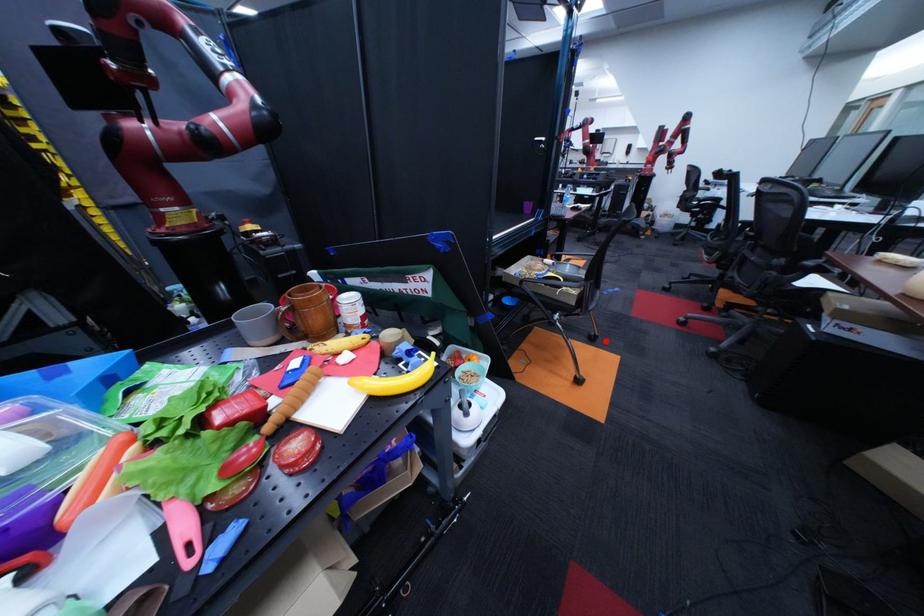
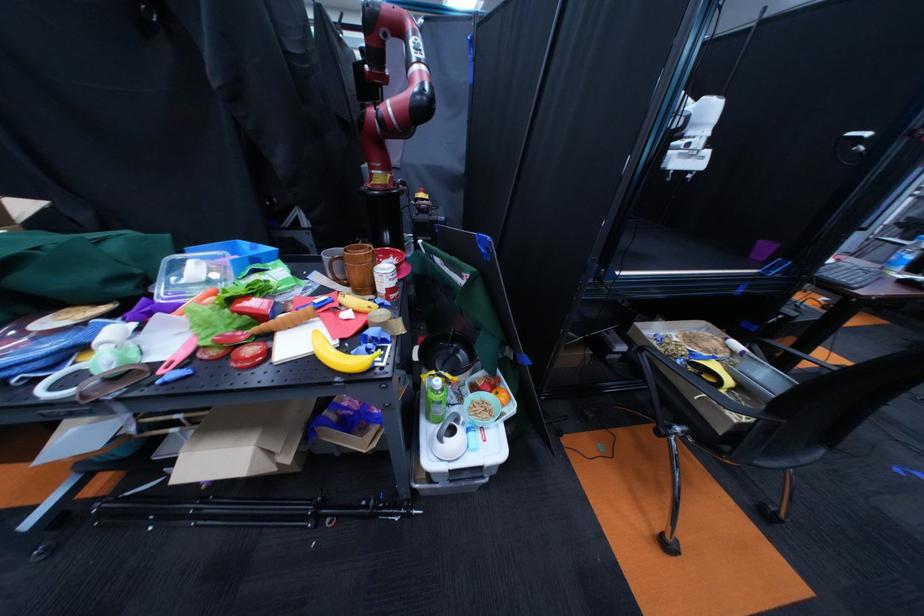
Question: I am providing you with two images of the same scene from different viewpoints. Given a red point in image1, look at the same physical point in image2. Is it:

Choices:
 (A) Closer to the viewpoint
 (B) Farther from the viewpoint

Answer: (A)